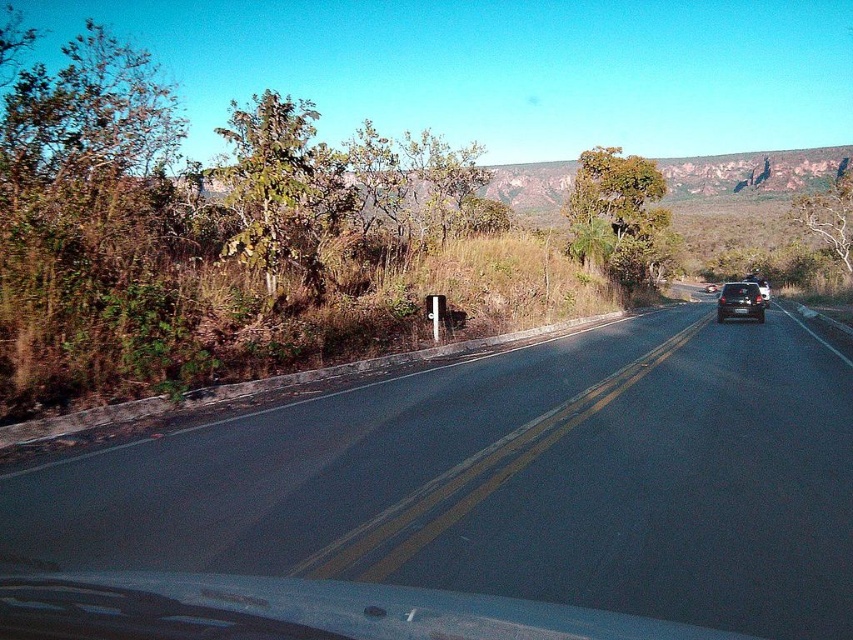
Question: Which object is closer to the camera taking this photo?

Choices:
 (A) satin black car at right
 (B) black asphalt road at center

Answer: (B)

Question: Can you confirm if black asphalt road at center is positioned below satin black car at right?

Choices:
 (A) yes
 (B) no

Answer: (A)

Question: Is black asphalt road at center bigger than satin black car at right?

Choices:
 (A) yes
 (B) no

Answer: (B)

Question: Is black asphalt road at center positioned at the back of satin black car at right?

Choices:
 (A) no
 (B) yes

Answer: (A)